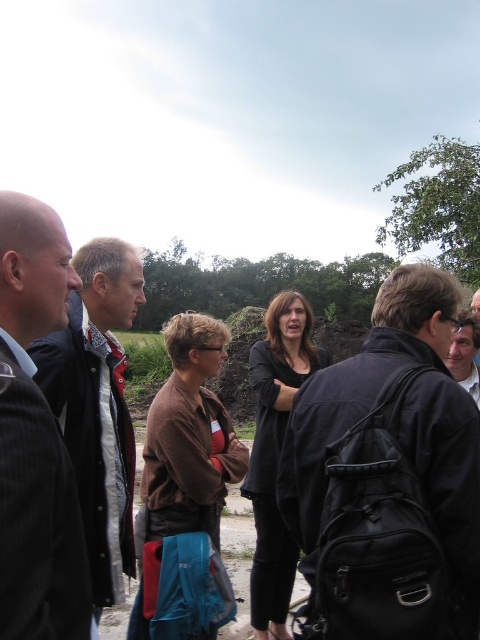
Is brown sweater at center bigger than matte black backpack at center?

Yes.

Can you confirm if brown sweater at center is positioned above matte black backpack at center?

No.

Is point (175, 355) farther from camera compared to point (298, 364)?

No, (175, 355) is in front of (298, 364).

At what (x,y) coordinates should I click in order to perform the action: click on brown sweater at center. Please return your answer as a coordinate pair (x, y). The image size is (480, 640). Looking at the image, I should click on (187, 445).

Who is taller, dark suit at left or matte black backpack at center?

matte black backpack at center

Does dark suit at left have a greater width compared to matte black backpack at center?

No.

Is point (24, 598) more distant than point (465, 387)?

No, it is not.

The width and height of the screenshot is (480, 640). What are the coordinates of `dark suit at left` in the screenshot? It's located at (36, 436).

Can you confirm if black leather backpack at center is shorter than brown sweater at center?

Indeed, black leather backpack at center has a lesser height compared to brown sweater at center.

Who is positioned more to the left, black leather backpack at center or brown sweater at center?

Positioned to the left is brown sweater at center.

Between point (470, 598) and point (236, 465), which one is positioned behind?

The point (236, 465) is more distant.

Where is `black leather backpack at center`? black leather backpack at center is located at coordinates (388, 476).